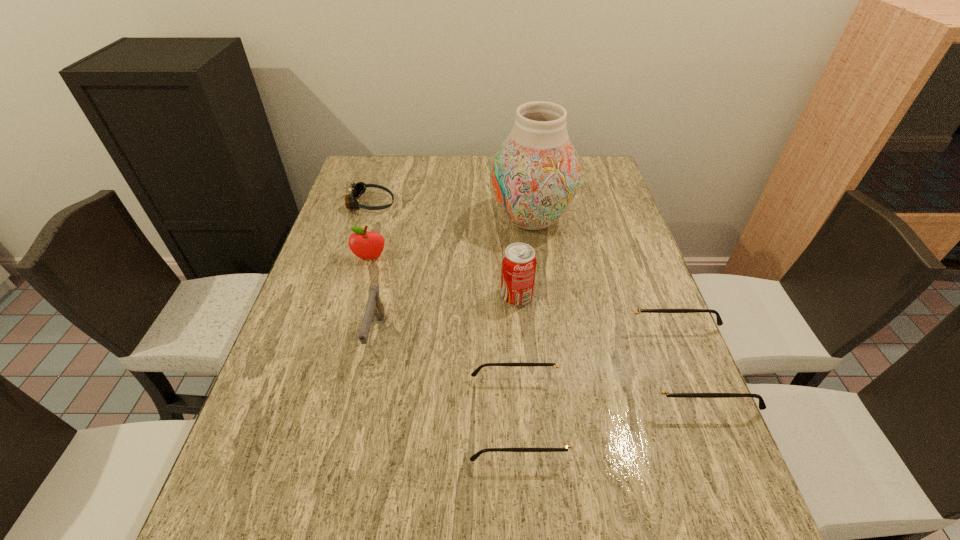
The image size is (960, 540). Identify the location of the left spectacles. tap(559, 390).

Locate an element on the screen. the rightmost object is located at coordinates (655, 385).

Locate an element on the screen. This screenshot has width=960, height=540. the third shortest object is located at coordinates (655, 385).

Locate an element on the screen. apple is located at coordinates (366, 245).

This screenshot has width=960, height=540. Find the location of `the second tallest object`. the second tallest object is located at coordinates (519, 260).

This screenshot has height=540, width=960. What are the coordinates of `the fourth nearest object` in the screenshot? It's located at (519, 260).

Locate an element on the screen. goggles is located at coordinates (356, 190).

The image size is (960, 540). Identify the location of vase. (535, 174).

The height and width of the screenshot is (540, 960). What are the coordinates of `the fifth object from right to left` in the screenshot? It's located at (374, 307).

The width and height of the screenshot is (960, 540). I want to click on free region located at the hinge ends of the left spectacles, so click(615, 418).